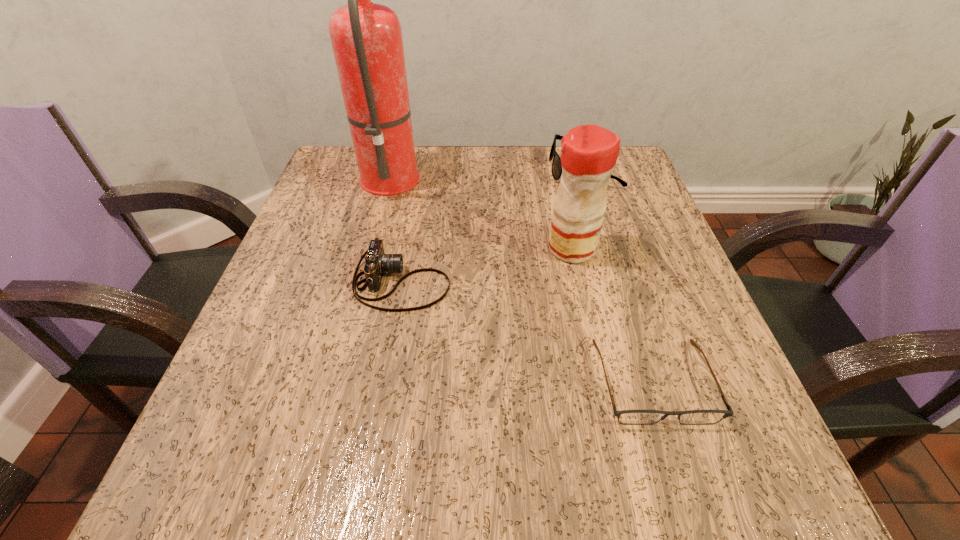
This screenshot has height=540, width=960. I want to click on fire extinguisher, so click(366, 37).

Find the location of a particular element. The image size is (960, 540). condiment is located at coordinates (589, 153).

Find the location of a particular element. sunglasses is located at coordinates (556, 169).

Locate an element on the screen. camera is located at coordinates click(x=377, y=262).

This screenshot has width=960, height=540. Identify the location of spectacles. (630, 417).

I want to click on the nearest object, so click(630, 417).

Identify the location of vacant position located with the handle and hose on the fire extinguisher. 463,174.

This screenshot has height=540, width=960. Find the location of `blank area located on the left of the condiment`. blank area located on the left of the condiment is located at coordinates (511, 249).

Locate an element on the screen. This screenshot has height=540, width=960. vacant space located on the front-facing side of the sunglasses is located at coordinates (420, 171).

Where is `free space located 0.060m on the front-facing side of the sunglasses`? This screenshot has width=960, height=540. free space located 0.060m on the front-facing side of the sunglasses is located at coordinates (525, 171).